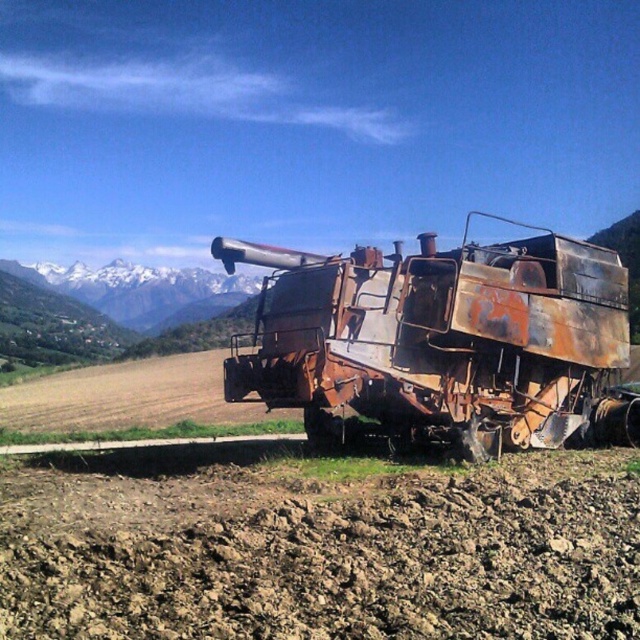
Who is positioned more to the right, rusty metal trailer truck at center or white snow-covered mountain at upper left?

From the viewer's perspective, rusty metal trailer truck at center appears more on the right side.

Is rusty metal trailer truck at center positioned in front of white snow-covered mountain at upper left?

Yes, it is in front of white snow-covered mountain at upper left.

At what (x,y) coordinates should I click in order to perform the action: click on rusty metal trailer truck at center. Please return your answer as a coordinate pair (x, y). The height and width of the screenshot is (640, 640). Looking at the image, I should click on (442, 340).